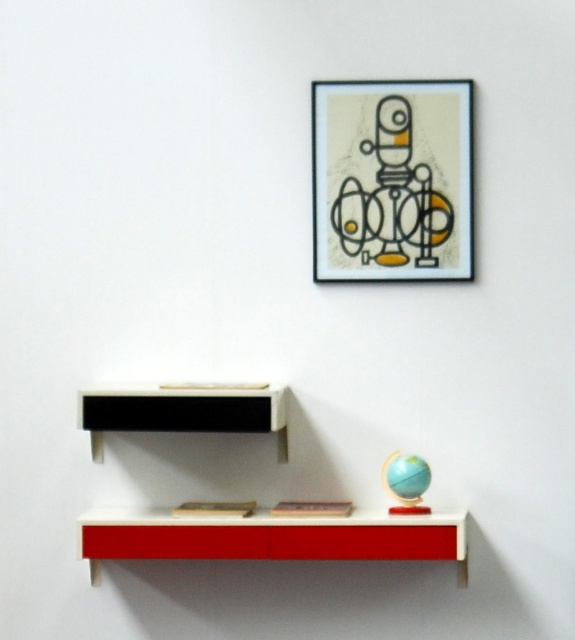
Question: Where is white glossy bookshelf at center located in relation to white matte shelf at center in the image?

Choices:
 (A) right
 (B) left

Answer: (A)

Question: Can you confirm if matte black picture frame at upper center is positioned to the left of matte red cabinet at lower center?

Choices:
 (A) yes
 (B) no

Answer: (B)

Question: Among these points, which one is nearest to the camera?

Choices:
 (A) (317, 132)
 (B) (155, 403)

Answer: (B)

Question: Is matte black picture frame at upper center to the left of matte red cabinet at lower center from the viewer's perspective?

Choices:
 (A) no
 (B) yes

Answer: (A)

Question: Among these points, which one is nearest to the camera?

Choices:
 (A) (270, 410)
 (B) (423, 531)

Answer: (B)

Question: Which object appears farthest from the camera in this image?

Choices:
 (A) white matte shelf at center
 (B) matte black picture frame at upper center

Answer: (B)